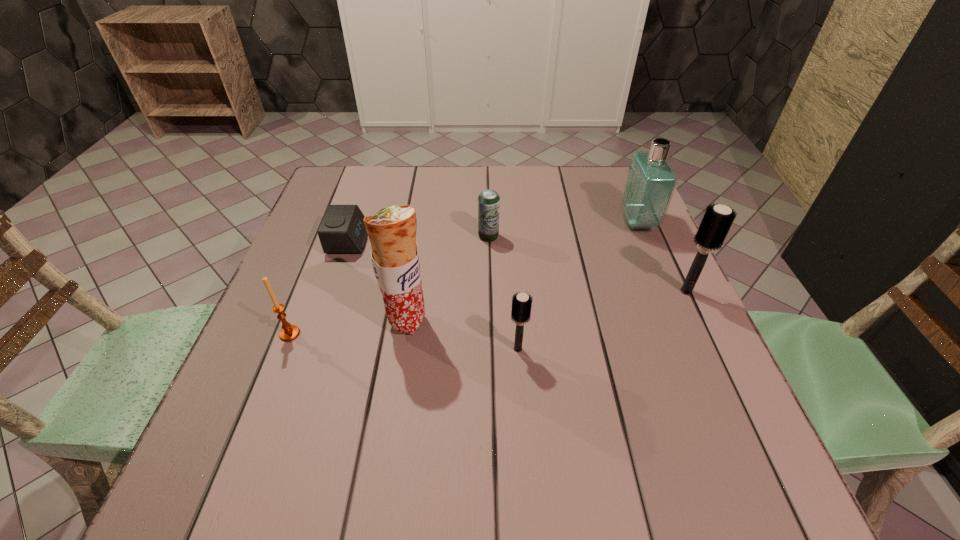
In order to click on the sixth closest object relative to the alarm clock in this screenshot , I will do click(x=717, y=220).

Identify which object is the fourth nearest to the beer can. Please provide its 2D coordinates. Your answer should be formatted as a tuple, i.e. [(x, y)], where the tuple contains the x and y coordinates of a point satisfying the conditions above.

[(650, 183)]

Identify the location of free space that satisfies the following two spatial constraints: 1. on the back side of the taller hairbrush; 2. on the right side of the burrito. The height and width of the screenshot is (540, 960). (412, 291).

This screenshot has width=960, height=540. What are the coordinates of `vacant region that satisfies the following two spatial constraints: 1. on the back side of the left hairbrush; 2. on the right side of the right hairbrush` in the screenshot? It's located at (514, 291).

In order to click on vacant region that satisfies the following two spatial constraints: 1. on the front side of the left hairbrush; 2. on the right side of the candle_holder in this screenshot , I will do `click(284, 349)`.